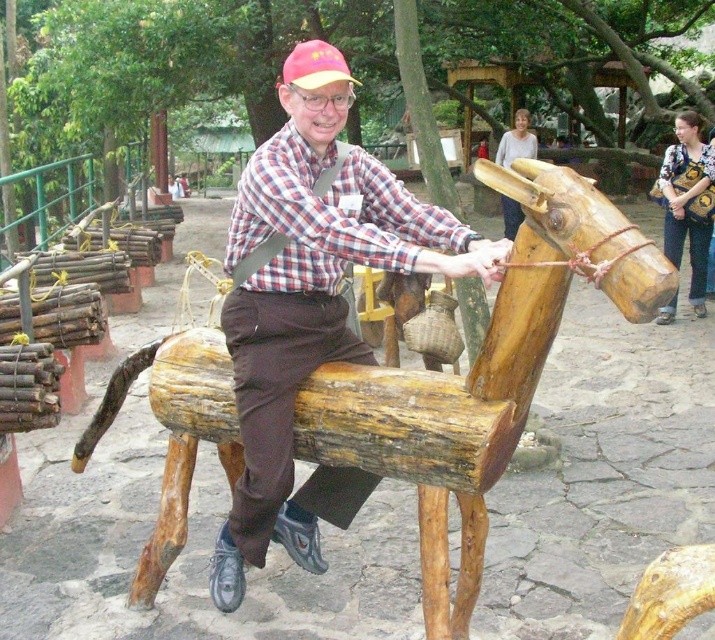
Question: Can you confirm if natural wood horse at center is positioned below wooden horse at center?

Choices:
 (A) no
 (B) yes

Answer: (B)

Question: Which point is farther from the camera taking this photo?

Choices:
 (A) (257, 387)
 (B) (226, 364)

Answer: (B)

Question: Among these objects, which one is farthest from the camera?

Choices:
 (A) wooden horse at center
 (B) natural wood horse at center

Answer: (A)

Question: In this image, where is natural wood horse at center located relative to wooden horse at center?

Choices:
 (A) above
 (B) below

Answer: (B)

Question: Can you confirm if natural wood horse at center is bigger than wooden horse at center?

Choices:
 (A) no
 (B) yes

Answer: (A)

Question: Which point is closer to the camera?

Choices:
 (A) (280, 454)
 (B) (498, 467)

Answer: (B)